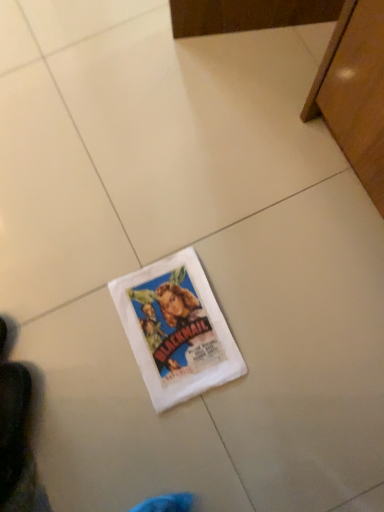
Find the location of a particular element. white paper flyer at center is located at coordinates (176, 329).

Describe the element at coordinates (176, 329) in the screenshot. I see `white paper flyer at center` at that location.

I want to click on white paper flyer at center, so click(176, 329).